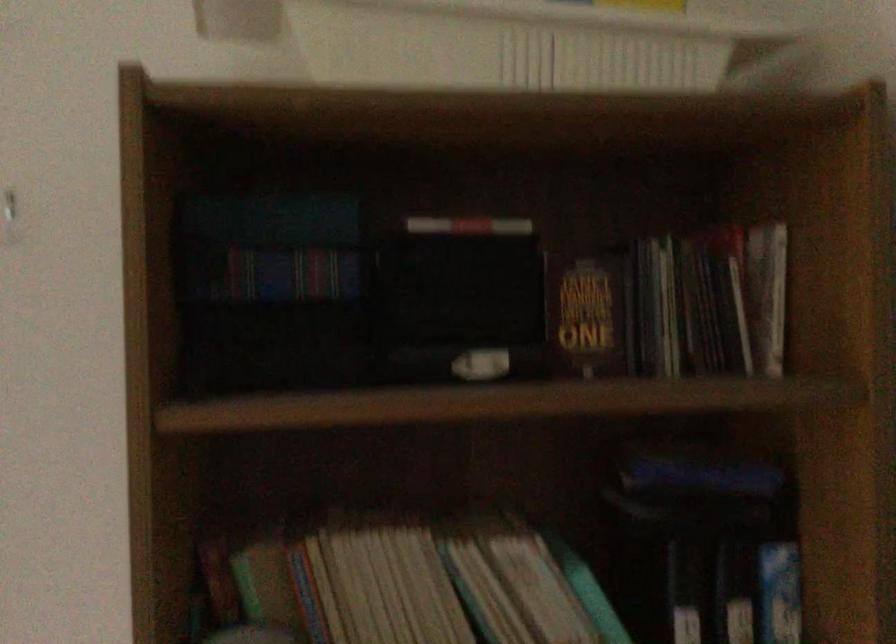
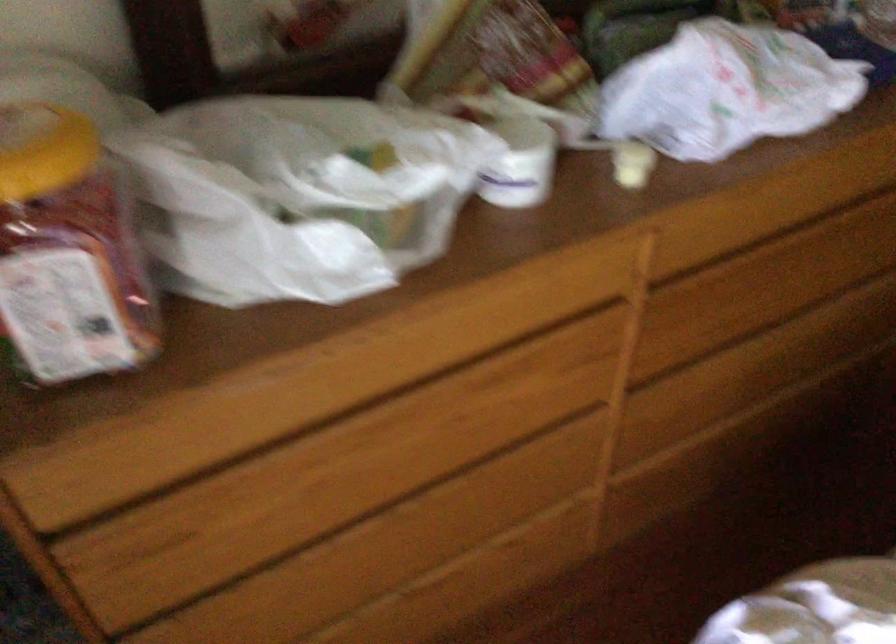
First-person continuous shooting, in which direction is the camera rotating?

The camera rotated toward right-down.